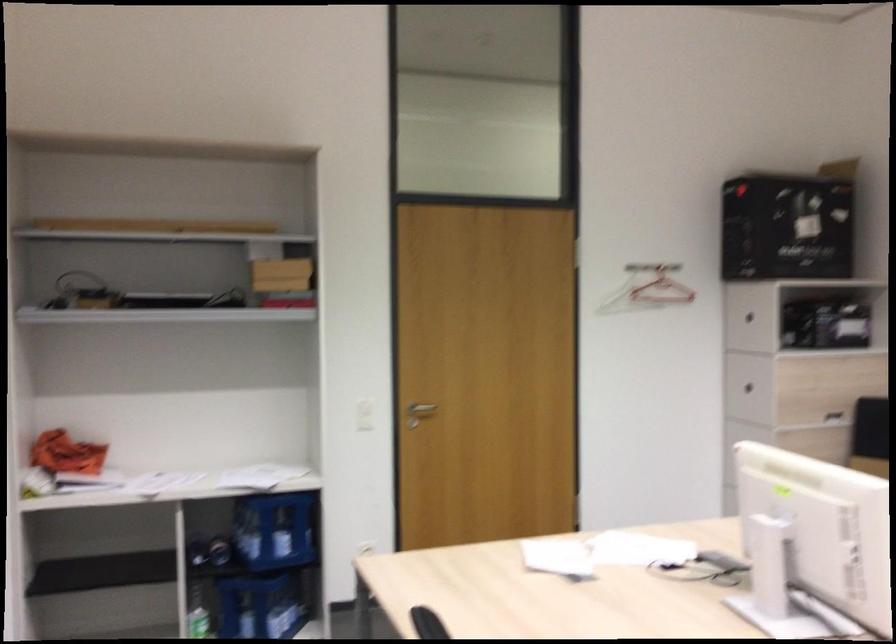
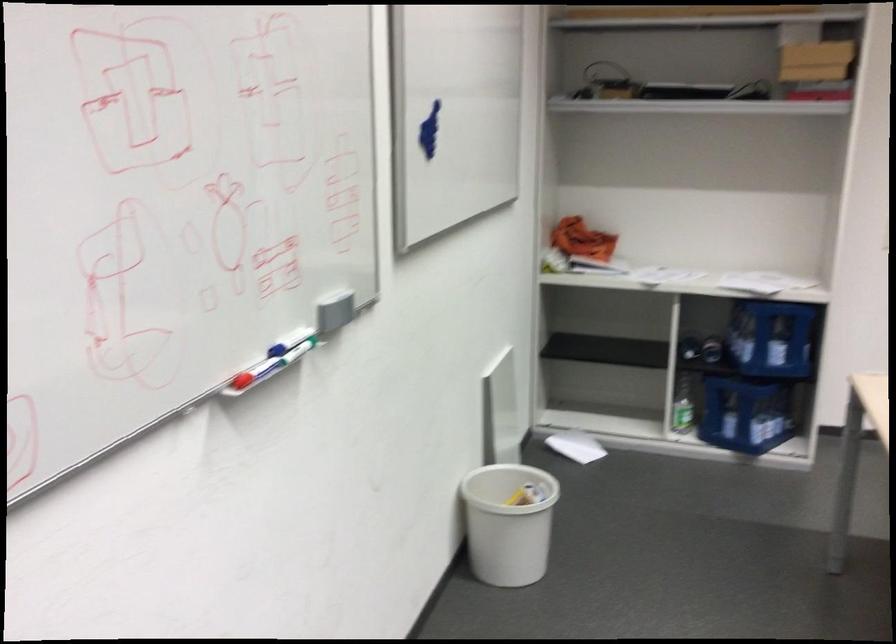
Question: How did the camera likely rotate?

Choices:
 (A) Left
 (B) Right
 (C) Up
 (D) Down

Answer: (A)